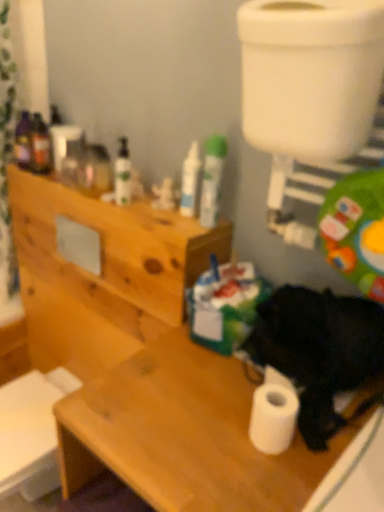
Where is `empty space that is ontop of wooden cabinet at upper left (from a real-world perspective)`? empty space that is ontop of wooden cabinet at upper left (from a real-world perspective) is located at coordinates (x=123, y=196).